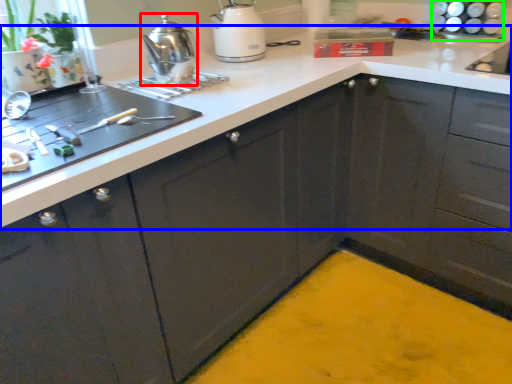
Question: Based on their relative distances, which object is nearer to kitchen appliance (highlighted by a red box)? Choose from countertop (highlighted by a blue box) and appliance (highlighted by a green box).

Choices:
 (A) countertop
 (B) appliance

Answer: (A)